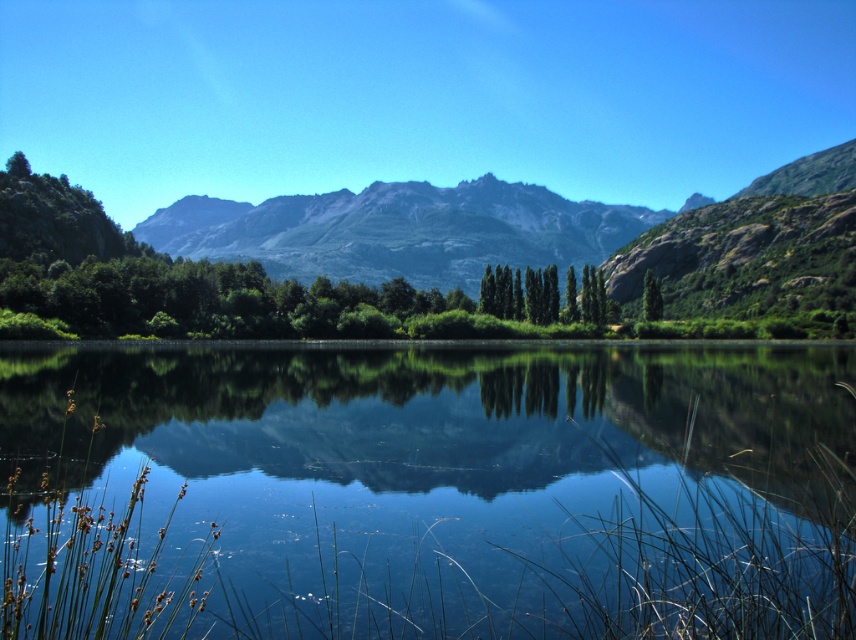
Is green rocky mountain range at center positioned in front of green glossy tree at center?

No, it is not.

Describe the element at coordinates (399, 230) in the screenshot. I see `green rocky mountain range at center` at that location.

In order to click on green rocky mountain range at center in this screenshot , I will do `click(399, 230)`.

Which is above, green smooth trees at center or green glossy tree at center?

green glossy tree at center is higher up.

Who is more distant from viewer, (500, 275) or (652, 298)?

The point (500, 275) is behind.

Between point (598, 301) and point (642, 312), which one is positioned behind?

Point (642, 312)

Identify the location of green smooth trees at center. (542, 296).

Is transparent water at center wider than green smooth trees at center?

Correct, the width of transparent water at center exceeds that of green smooth trees at center.

Which is below, transparent water at center or green smooth trees at center?

transparent water at center is below.

The image size is (856, 640). What do you see at coordinates (428, 492) in the screenshot?
I see `transparent water at center` at bounding box center [428, 492].

At what (x,y) coordinates should I click in order to perform the action: click on transparent water at center. Please return your answer as a coordinate pair (x, y). The width and height of the screenshot is (856, 640). Looking at the image, I should click on (428, 492).